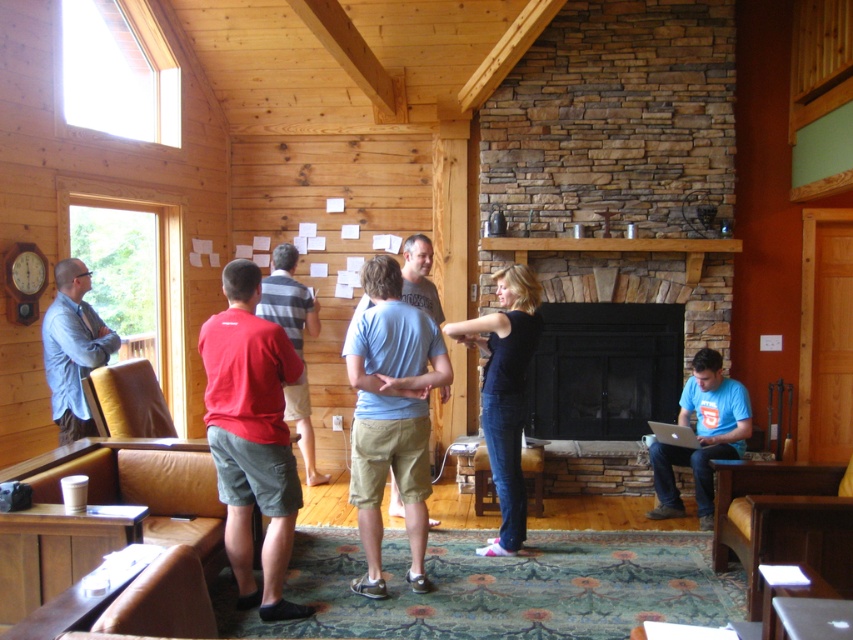
Question: Which is nearer to the red cotton shirt at center?

Choices:
 (A) red cotton t-shirt at center
 (B) blue t-shirt at right

Answer: (A)

Question: Considering the relative positions of blue t-shirt at right and matte blue shirt at left in the image provided, where is blue t-shirt at right located with respect to matte blue shirt at left?

Choices:
 (A) left
 (B) right

Answer: (B)

Question: Can you confirm if light blue cotton shirt at center is thinner than black matte fireplace at center?

Choices:
 (A) no
 (B) yes

Answer: (B)

Question: Which object appears farthest from the camera in this image?

Choices:
 (A) red cotton t-shirt at center
 (B) black cotton shirt at center

Answer: (B)

Question: Which object is positioned farthest from the blue t-shirt at right?

Choices:
 (A) matte blue shirt at left
 (B) black cotton shirt at center

Answer: (A)

Question: Can you confirm if matte blue shirt at left is bigger than red cotton shirt at center?

Choices:
 (A) yes
 (B) no

Answer: (B)